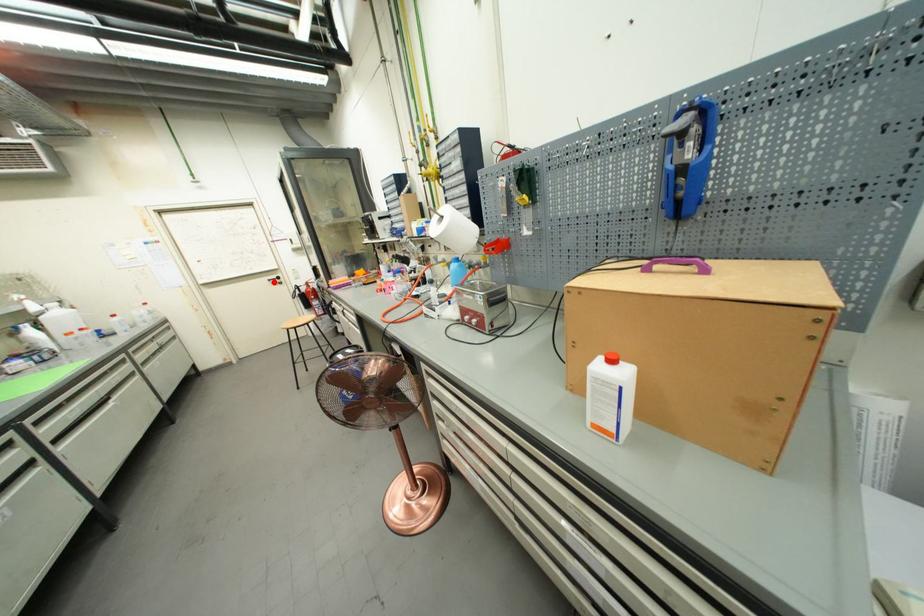
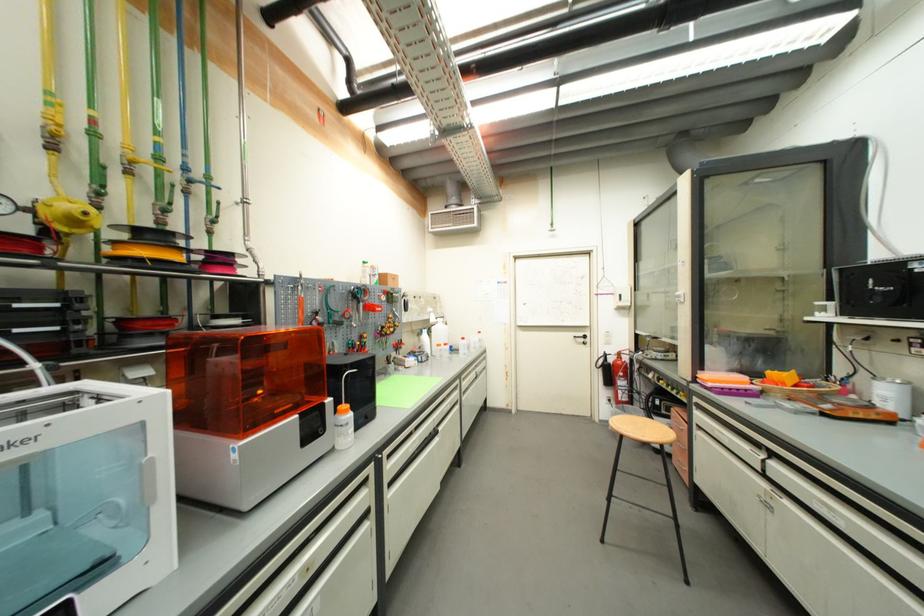
In the second image, find the point that corresponds to the highlighted location in the first image.

(580, 339)